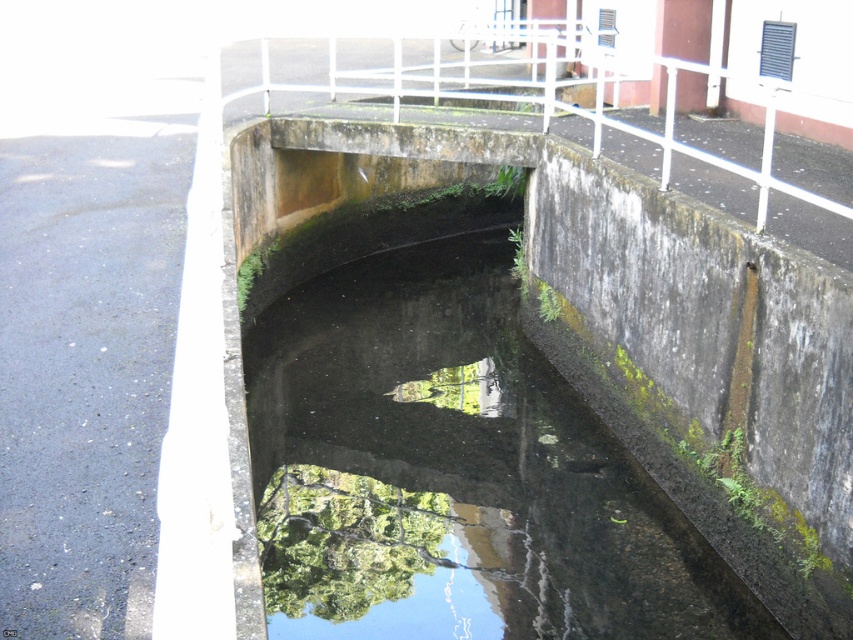
Question: Which of the following is the farthest from the observer?

Choices:
 (A) white metal rail at upper center
 (B) green mossy concrete puddle at center

Answer: (B)

Question: Observing the image, what is the correct spatial positioning of green mossy concrete puddle at center in reference to white metal rail at upper center?

Choices:
 (A) left
 (B) right

Answer: (A)

Question: Among these objects, which one is nearest to the camera?

Choices:
 (A) green mossy concrete puddle at center
 (B) white metal rail at upper center

Answer: (B)

Question: In this image, where is green mossy concrete puddle at center located relative to white metal rail at upper center?

Choices:
 (A) above
 (B) below

Answer: (B)

Question: Can you confirm if green mossy concrete puddle at center is smaller than white metal rail at upper center?

Choices:
 (A) yes
 (B) no

Answer: (A)